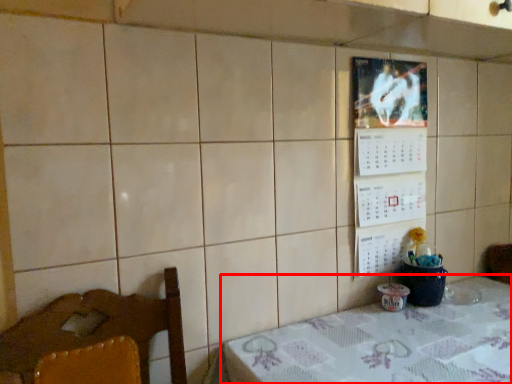
Question: Considering the relative positions of table (annotated by the red box) and bulletin board in the image provided, where is table (annotated by the red box) located with respect to the staircase?

Choices:
 (A) right
 (B) left

Answer: (A)